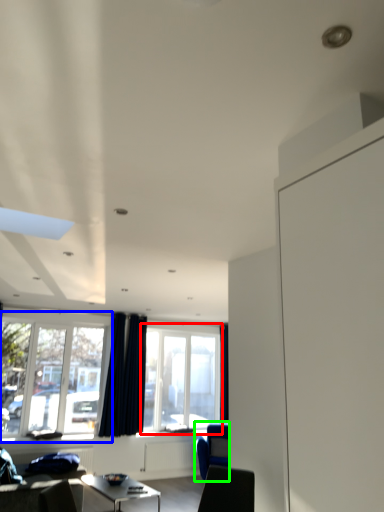
Question: Based on their relative distances, which object is nearer to window (highlighted by a red box)? Choose from window (highlighted by a blue box) and armchair (highlighted by a green box).

Choices:
 (A) window
 (B) armchair

Answer: (B)